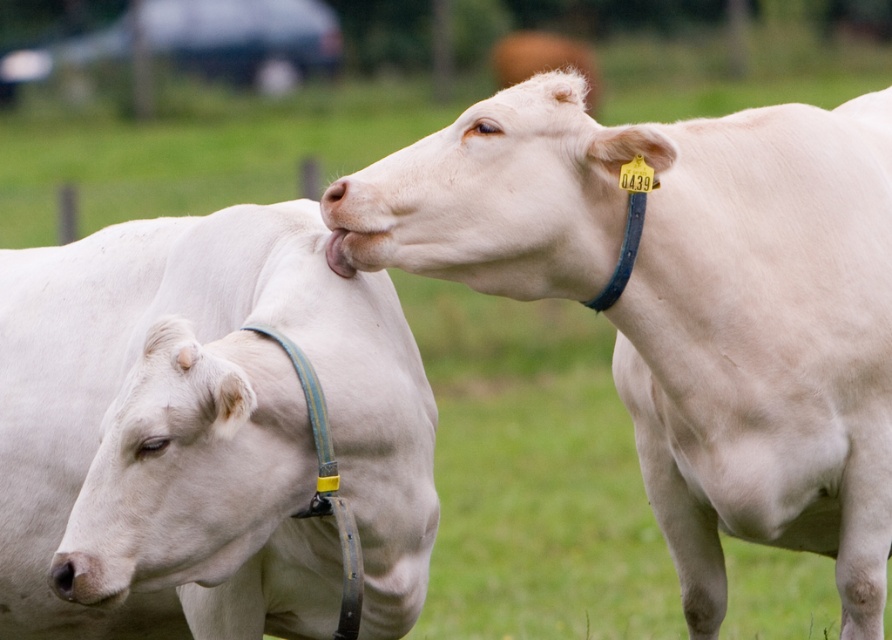
You are a farmer checking the cows in the field. You see the white smooth cow at upper right and the white leather collar at left. Which one is positioned more to the right side of the image?

The white smooth cow at upper right is positioned more to the right side of the image than the white leather collar at left.

You are a farmer who needs to check the distance between the white smooth cow at upper right and the white leather collar at left. According to the image, how far apart are they?

The white smooth cow at upper right is 24.05 inches away from the white leather collar at left.

You are a farmer checking the cows in the field. You notice the white smooth cow at upper right and the white leather collar at left. Which object is closer to you?

The white smooth cow at upper right is closer to you than the white leather collar at left.